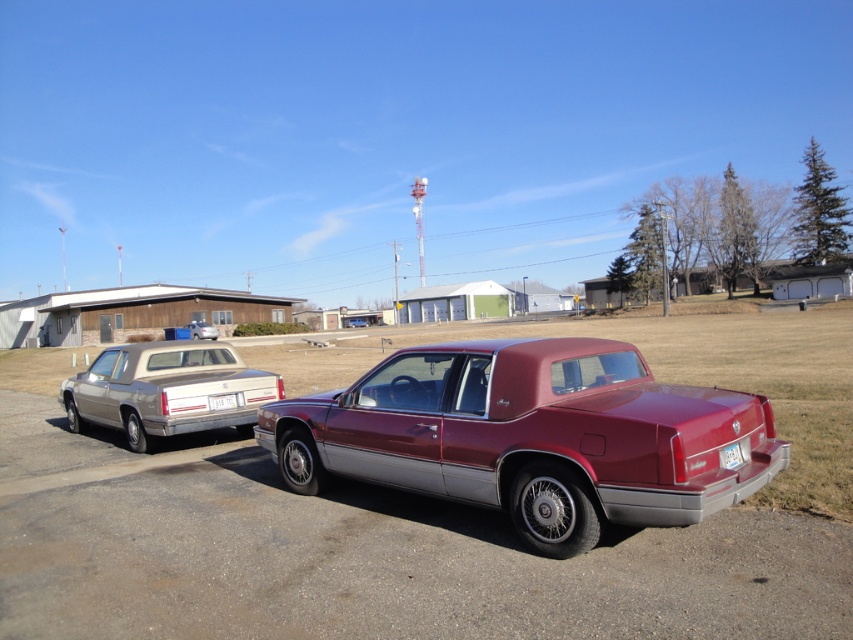
You are a delivery person trying to load a package onto the matte silver sedan at left. The package requires clearance of 1.2 meters to be placed on top. Can the white plastic license plate at center interfere with the package placement?

The matte silver sedan at left is taller than the white plastic license plate at center. Since the sedan is taller, the license plate won

You are standing at the center of the parking lot and want to locate the matte silver sedan at left. According to the coordinates provided, where should you look relative to your position?

The matte silver sedan at left is located at coordinates point 0.517 on the x axis and 0.238 on the y axis, so you should look to the left and slightly forward from your current position.

You are a parking attendant who needs to check the license plate of the maroon metallic sedan at center. However, you notice the white plastic license plate at center is blocking your view. Can you determine if the license plate is positioned to the left or right of the sedan?

The white plastic license plate at center is to the right of the maroon metallic sedan at center, so it is blocking the view from the right side of the sedan.